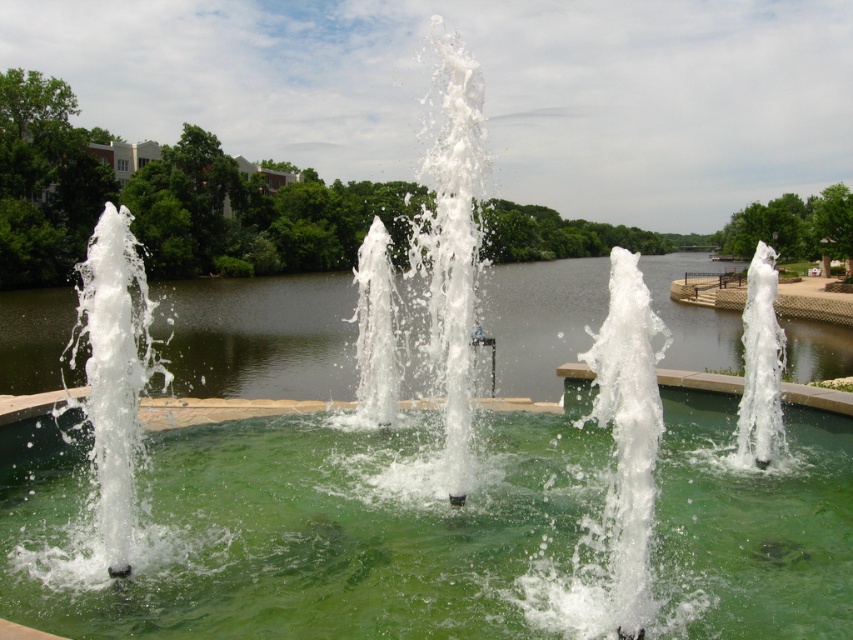
Question: Can you confirm if green glossy water at center is bigger than green water at center?

Choices:
 (A) yes
 (B) no

Answer: (B)

Question: Is green glossy water at center closer to camera compared to green water at center?

Choices:
 (A) no
 (B) yes

Answer: (A)

Question: Can you confirm if green glossy water at center is positioned below green water at center?

Choices:
 (A) yes
 (B) no

Answer: (A)

Question: Which object is closer to the camera taking this photo?

Choices:
 (A) green water at center
 (B) green glossy water at center

Answer: (A)

Question: Which object is farther from the camera taking this photo?

Choices:
 (A) green water at center
 (B) green glossy water at center

Answer: (B)